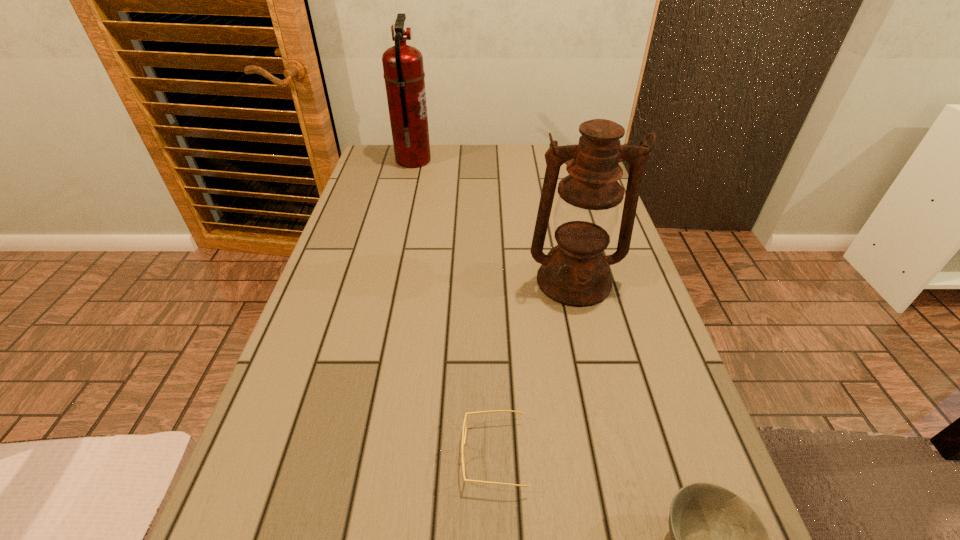
Image resolution: width=960 pixels, height=540 pixels. In order to click on free space between the spectacles and the third nearest object in this screenshot , I will do `click(534, 368)`.

This screenshot has height=540, width=960. Find the location of `free space between the third object from right to left and the farthest object`. free space between the third object from right to left and the farthest object is located at coordinates (454, 308).

This screenshot has width=960, height=540. I want to click on object that ranks as the closest to the third nearest object, so click(465, 423).

Where is `object that can be found as the closest to the oil lamp`? object that can be found as the closest to the oil lamp is located at coordinates (465, 423).

You are a GUI agent. You are given a task and a screenshot of the screen. Output one action in this format:
    pyautogui.click(x=<x>, y=<y>)
    Task: Click on the free point that satisfies the following two spatial constraints: 1. on the nozzle side of the farthest object; 2. on the back side of the third nearest object
    
    Given the screenshot: What is the action you would take?
    pyautogui.click(x=385, y=281)

Identify the location of vacant space that satisfies the following two spatial constraints: 1. on the nozzle side of the oil lamp; 2. on the right side of the leftmost object. The image size is (960, 540). (385, 281).

The width and height of the screenshot is (960, 540). In order to click on vacant space that satisfies the following two spatial constraints: 1. on the front side of the oil lamp; 2. in front of the lenses of the second nearest object in this screenshot , I will do `click(614, 455)`.

Locate an element on the screen. The height and width of the screenshot is (540, 960). vacant space that satisfies the following two spatial constraints: 1. on the nozzle side of the fire extinguisher; 2. on the left side of the third nearest object is located at coordinates (385, 281).

This screenshot has width=960, height=540. Find the location of `free point that satisfies the following two spatial constraints: 1. on the back side of the oil lamp; 2. on the nozzle side of the fire extinguisher`. free point that satisfies the following two spatial constraints: 1. on the back side of the oil lamp; 2. on the nozzle side of the fire extinguisher is located at coordinates (546, 160).

In order to click on free space that satisfies the following two spatial constraints: 1. on the nozzle side of the leftmost object; 2. on the back side of the oil lamp in this screenshot , I will do `click(385, 281)`.